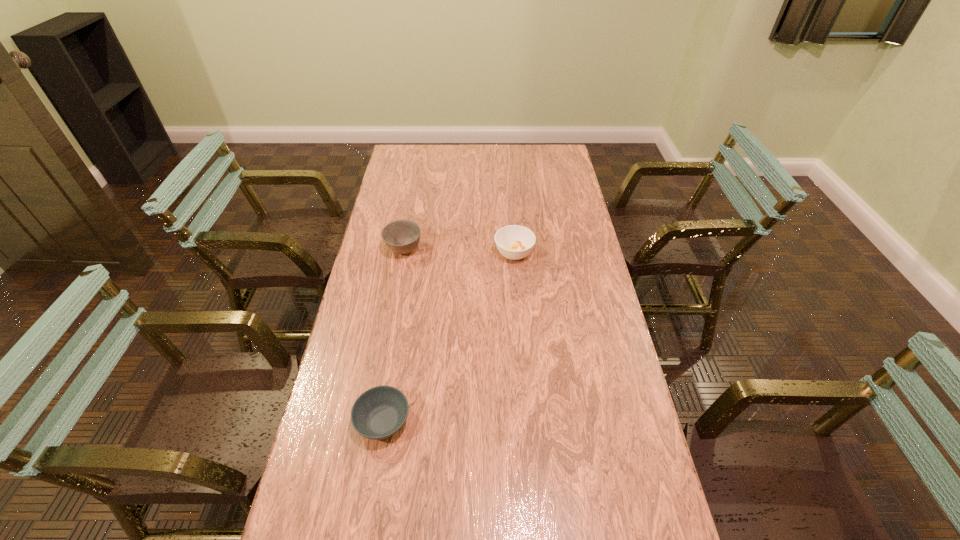
Select which object is the second closest to the bowl. Please provide its 2D coordinates. Your answer should be formatted as a tuple, i.e. [(x, y)], where the tuple contains the x and y coordinates of a point satisfying the conditions above.

[(378, 413)]

Identify the location of vacant space that satisfies the following two spatial constraints: 1. on the front side of the shorter soup bowl; 2. on the right side of the bowl. The height and width of the screenshot is (540, 960). (372, 421).